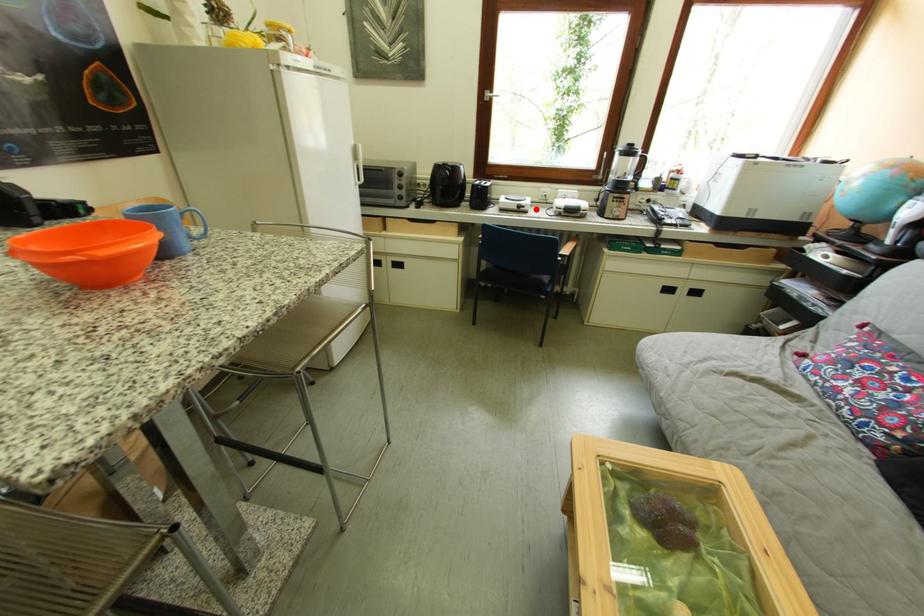
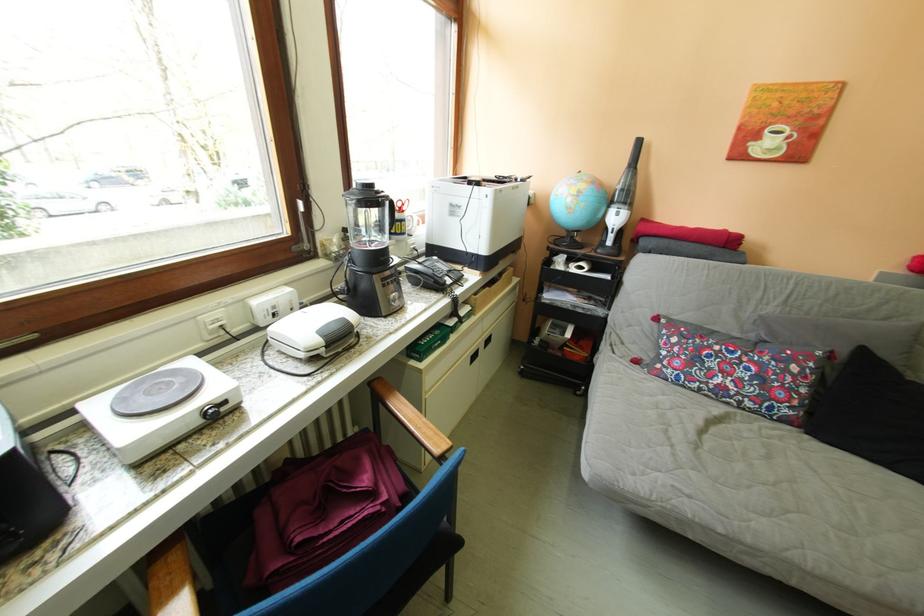
The point at the highlighted location is marked in the first image. Where is the corresponding point in the second image?

(237, 406)